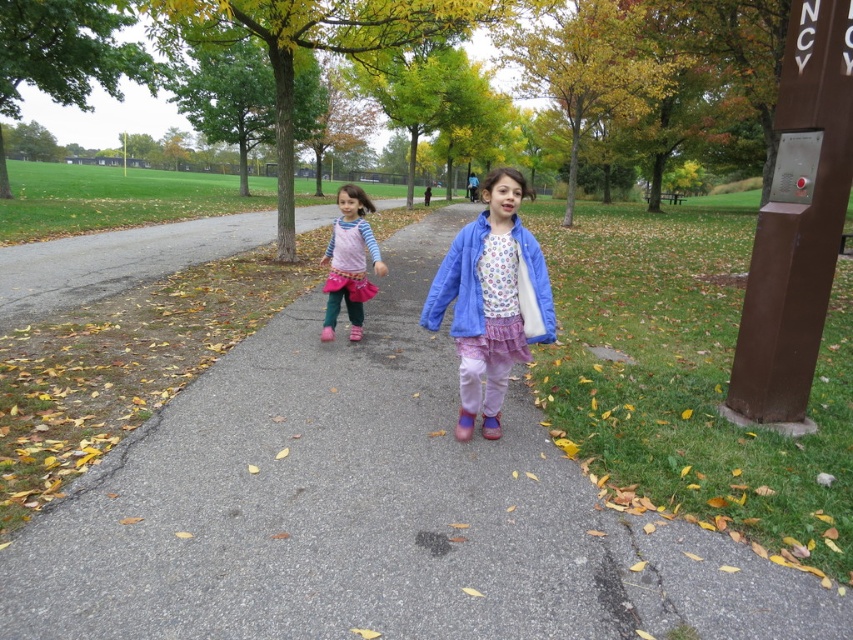
You are a photographer standing at the park entrance. You want to take a photo of the gray asphalt pavement at center and the matte pink skirt at center. Which object will appear larger in your photo?

The gray asphalt pavement at center will appear larger in the photo because it is closer to the viewer than the matte pink skirt at center.

Consider the image. You are a photographer planning to take a picture of the gray asphalt pavement at center and the matte pink skirt at center. Which object should you focus on if you want to capture the larger one in your shot?

The gray asphalt pavement at center is bigger than the matte pink skirt at center, so you should focus on the gray asphalt pavement at center to capture the larger one.

You are a photographer standing at the edge of the gray asphalt pavement at center and want to take a picture of the matte pink skirt at center. Considering the height difference between them, will you need to adjust your camera angle upwards or downwards to focus on the skirt?

The gray asphalt pavement at center is much taller than the matte pink skirt at center, so you would need to adjust your camera angle downwards to focus on the skirt.